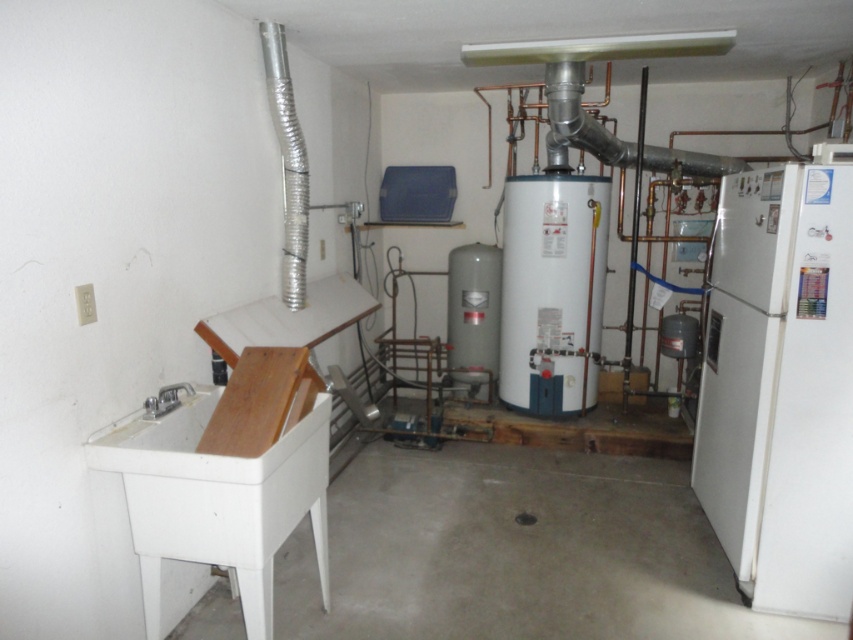
Between white glossy water heater at center right and silver metallic duct at upper left, which one appears on the left side from the viewer's perspective?

silver metallic duct at upper left

Is white glossy water heater at center right shorter than silver metallic duct at upper left?

No.

Find the location of a particular element. The width and height of the screenshot is (853, 640). white glossy water heater at center right is located at coordinates 552,291.

Can you confirm if white matte refrigerator at right is positioned to the right of white glossy water heater at center right?

Yes, white matte refrigerator at right is to the right of white glossy water heater at center right.

Based on the photo, between white matte refrigerator at right and white glossy water heater at center right, which one has more height?

With more height is white matte refrigerator at right.

Image resolution: width=853 pixels, height=640 pixels. Describe the element at coordinates (781, 385) in the screenshot. I see `white matte refrigerator at right` at that location.

This screenshot has height=640, width=853. I want to click on white matte refrigerator at right, so click(781, 385).

Can you confirm if gray matte water heater at center is bigger than silver metallic duct at upper left?

Yes, gray matte water heater at center is bigger than silver metallic duct at upper left.

Is gray matte water heater at center positioned behind silver metallic duct at upper left?

Yes, gray matte water heater at center is further from the viewer.

Consider the image. Who is more distant from viewer, (448, 278) or (283, 275)?

The point (448, 278) is behind.

In order to click on gray matte water heater at center in this screenshot , I will do `click(473, 314)`.